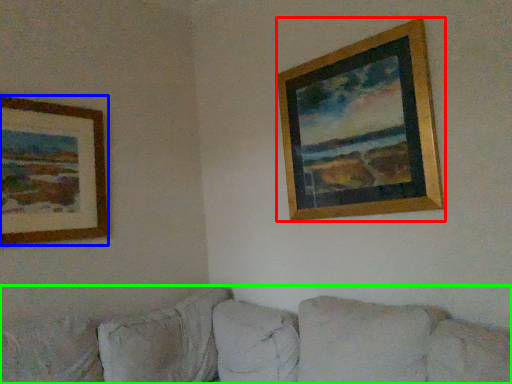
Question: Considering the real-world distances, which object is farthest from picture frame (highlighted by a red box)? picture frame (highlighted by a blue box) or studio couch (highlighted by a green box)?

Choices:
 (A) picture frame
 (B) studio couch

Answer: (A)